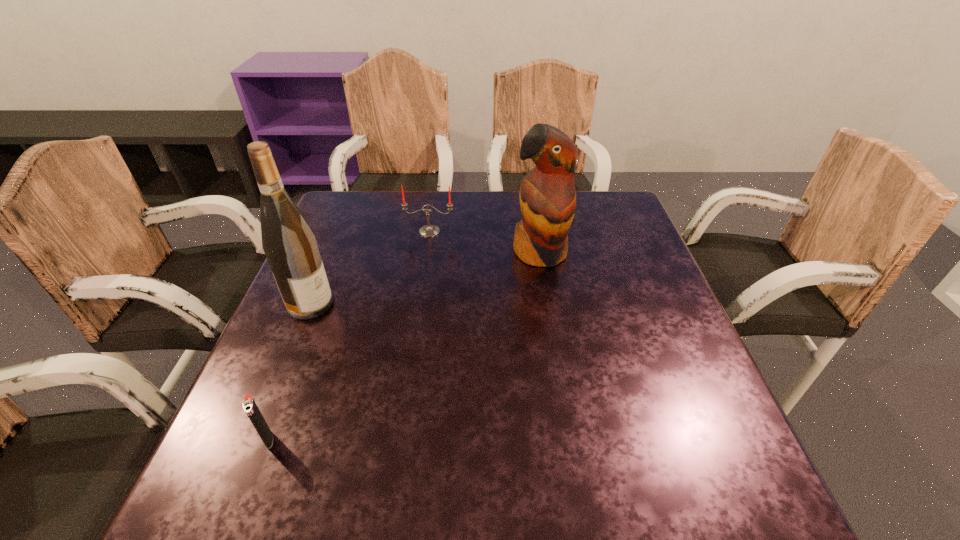
I want to click on free space that is in between the third tallest object and the wine bottle, so click(x=370, y=267).

What are the coordinates of `vacant area between the parrot and the shortest object` in the screenshot? It's located at (404, 346).

Locate an element on the screen. Image resolution: width=960 pixels, height=540 pixels. vacant space in between the nearest object and the third object from left to right is located at coordinates (349, 335).

This screenshot has height=540, width=960. I want to click on free point between the wine bottle and the nearest object, so click(x=289, y=371).

The height and width of the screenshot is (540, 960). What are the coordinates of `free space between the candle and the rightmost object` in the screenshot? It's located at (485, 242).

Locate an element on the screen. The image size is (960, 540). vacant space that's between the second shortest object and the parrot is located at coordinates (485, 242).

Locate an element on the screen. Image resolution: width=960 pixels, height=540 pixels. blank region between the candle and the second nearest object is located at coordinates (370, 267).

Where is `free space between the parrot and the third object from left to right`? free space between the parrot and the third object from left to right is located at coordinates (485, 242).

Where is `free spot between the wine bottle and the shortest object`? Image resolution: width=960 pixels, height=540 pixels. free spot between the wine bottle and the shortest object is located at coordinates (289, 371).

Locate an element on the screen. This screenshot has width=960, height=540. free space between the second object from right to left and the nearest object is located at coordinates (349, 335).